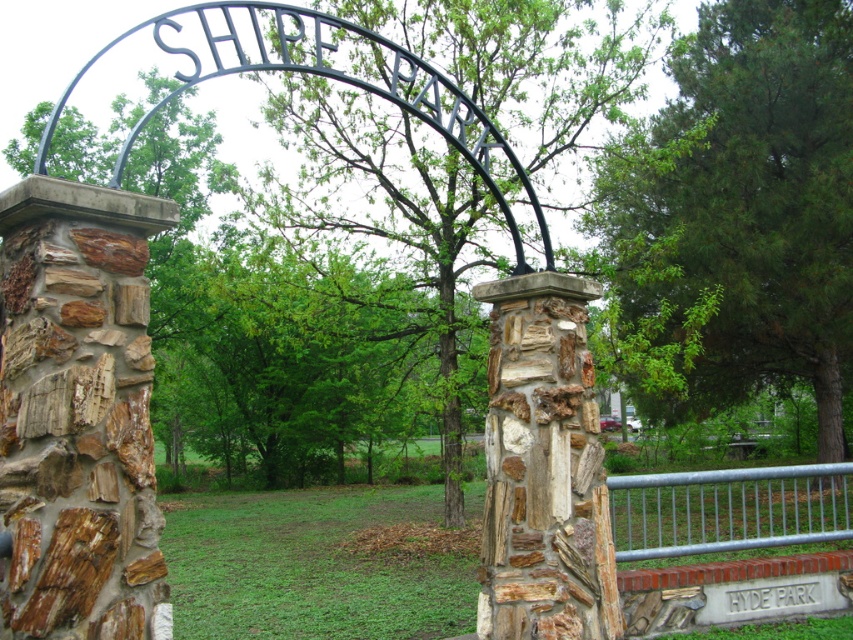
You are standing at the entrance of Shipe Park and notice the rustic stone pillar at center and the galvanized metal fence at lower right. Which object is larger in size?

The rustic stone pillar at center is smaller than the galvanized metal fence at lower right, so the galvanized metal fence at lower right is larger in size.

You are standing at the entrance of Shipe Park and see the rustic stone pillar at center and the galvanized metal fence at lower right. Which object is closer to you?

The rustic stone pillar at center is closer to you because it is positioned over the galvanized metal fence at lower right, indicating it is in a forward plane.